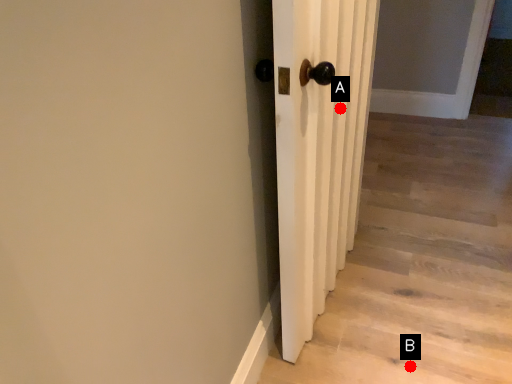
Question: Two points are circled on the image, labeled by A and B beside each circle. Which point is closer to the camera taking this photo?

Choices:
 (A) A is closer
 (B) B is closer

Answer: (A)